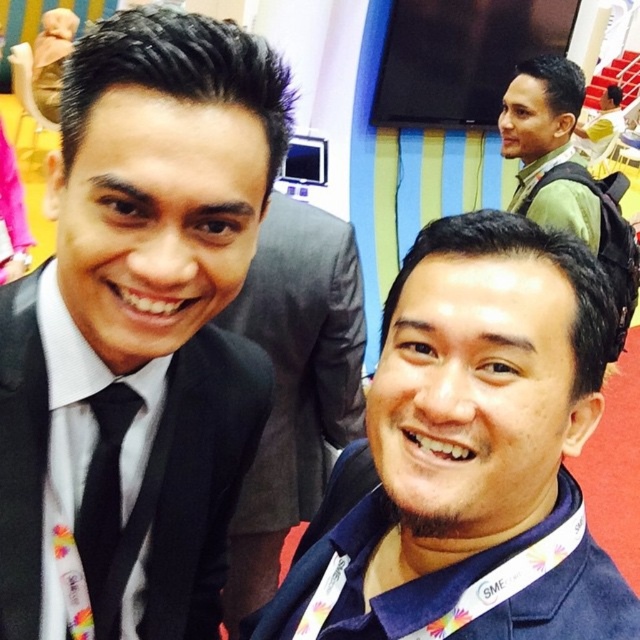
Question: Does matte black suit at left have a lesser width compared to blue fabric shirt at center?

Choices:
 (A) yes
 (B) no

Answer: (A)

Question: Which point is closer to the camera taking this photo?

Choices:
 (A) (150, 179)
 (B) (100, 404)
 (C) (524, 323)

Answer: (A)

Question: Can you confirm if matte black suit at left is positioned below blue fabric shirt at center?

Choices:
 (A) yes
 (B) no

Answer: (B)

Question: Which of these objects is positioned farthest from the green matte jacket at upper right?

Choices:
 (A) black satin tie at left
 (B) matte black suit at left

Answer: (A)

Question: Is matte black suit at left above blue fabric shirt at center?

Choices:
 (A) no
 (B) yes

Answer: (B)

Question: Which object is positioned farthest from the blue fabric shirt at center?

Choices:
 (A) black satin tie at left
 (B) matte black suit at left
 (C) green matte jacket at upper right
 (D) black smooth suit at center

Answer: (C)